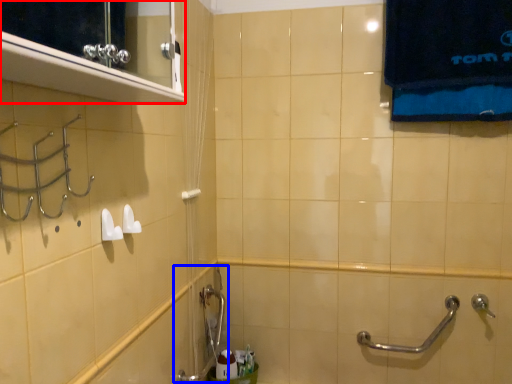
Question: Which object appears closest to the camera in this image, medicine cabinet (highlighted by a red box) or plumbing fixture (highlighted by a blue box)?

Choices:
 (A) medicine cabinet
 (B) plumbing fixture

Answer: (A)